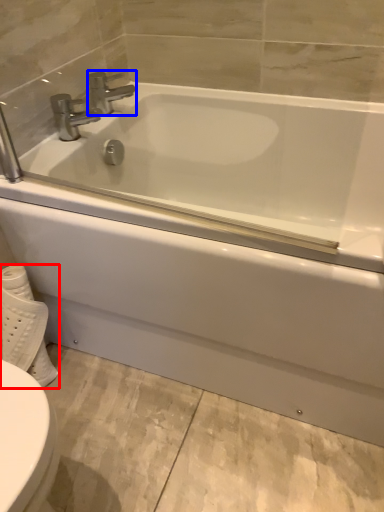
Question: Which object appears farthest to the camera in this image, toilet paper (highlighted by a red box) or tap (highlighted by a blue box)?

Choices:
 (A) toilet paper
 (B) tap

Answer: (B)